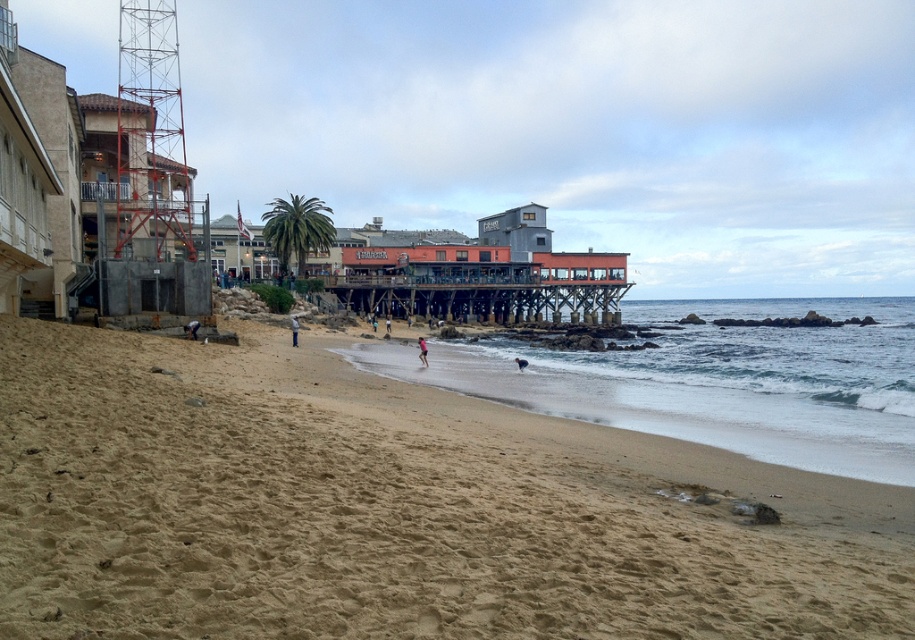
Which is more to the left, wooden pier at center or blue jeans at center?

blue jeans at center

Is wooden pier at center to the left of blue jeans at center from the viewer's perspective?

In fact, wooden pier at center is to the right of blue jeans at center.

In the scene shown: Who is more distant from viewer, (507, 323) or (190, 324)?

The point (507, 323) is behind.

At what (x,y) coordinates should I click in order to perform the action: click on wooden pier at center. Please return your answer as a coordinate pair (x, y). This screenshot has height=640, width=915. Looking at the image, I should click on (477, 298).

Looking at this image, who is positioned more to the right, blue jeans at center or light blue fabric at center?

blue jeans at center

Which is below, blue jeans at center or light blue fabric at center?

Positioned lower is blue jeans at center.

Who is more distant from viewer, (189, 328) or (298, 326)?

The point (298, 326) is behind.

At what (x,y) coordinates should I click in order to perform the action: click on blue jeans at center. Please return your answer as a coordinate pair (x, y). Image resolution: width=915 pixels, height=640 pixels. Looking at the image, I should click on (191, 328).

Which is behind, point (196, 336) or point (421, 356)?

The point (421, 356) is more distant.

Between point (194, 321) and point (424, 356), which one is positioned behind?

The point (424, 356) is behind.

This screenshot has width=915, height=640. What are the coordinates of `blue jeans at center` in the screenshot? It's located at (191, 328).